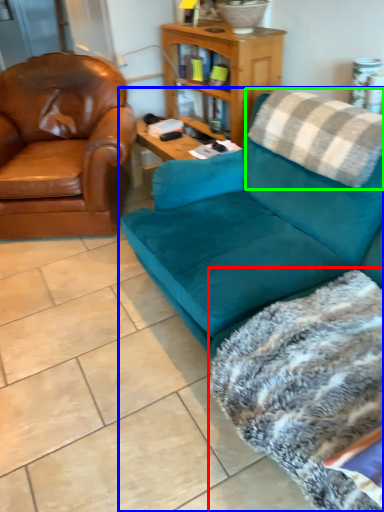
Question: Based on their relative distances, which object is nearer to blanket (highlighted by a red box)? Choose from studio couch (highlighted by a blue box) and pillow (highlighted by a green box).

Choices:
 (A) studio couch
 (B) pillow

Answer: (A)